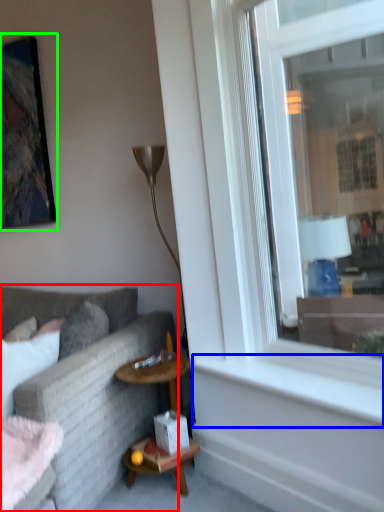
Question: Which object is positioned closest to studio couch (highlighted by a red box)? Select from window sill (highlighted by a blue box) and picture frame (highlighted by a green box).

Choices:
 (A) window sill
 (B) picture frame

Answer: (A)